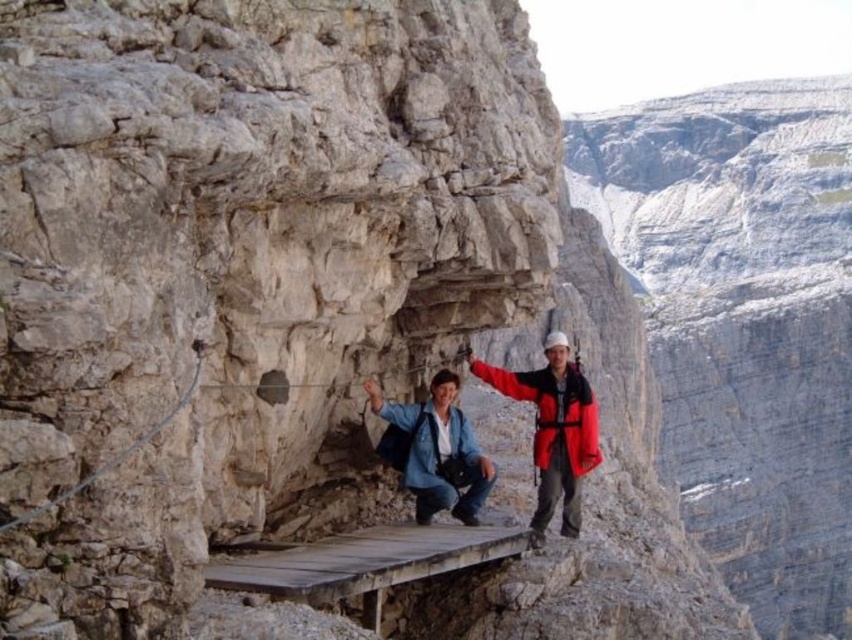
You are a photographer standing at the edge of the wooden platform. You want to capture a photo of the gray rock cliff at right in the foreground while including the two people on the platform. Since the cliff is 105.09 meters away, will you need to adjust your camera focus to ensure both the cliff and the people are in focus?

The gray rock cliff at right is 105.09 meters from the camera. To ensure both the cliff and the people on the platform are in focus, you should adjust your camera focus to a point that covers this distance, possibly using a smaller aperture for a greater depth of field.

You are a hiker who needs to take a photo of the gray rock cliff at right from the wooden platform. Where should you stand on the platform to ensure the cliff is in the frame?

To take a photo of the gray rock cliff at right from the wooden platform, you should stand at the position corresponding to the coordinates provided in the description, which is at point (743, 323). This ensures the cliff is centered in your frame.

You are a hiker planning to cross the narrow wooden platform between the gray rock cliff at right and the matte blue jacket at center. Based on the scene, which object is higher in elevation?

The gray rock cliff at right is located above the matte blue jacket at center, so it is higher in elevation.